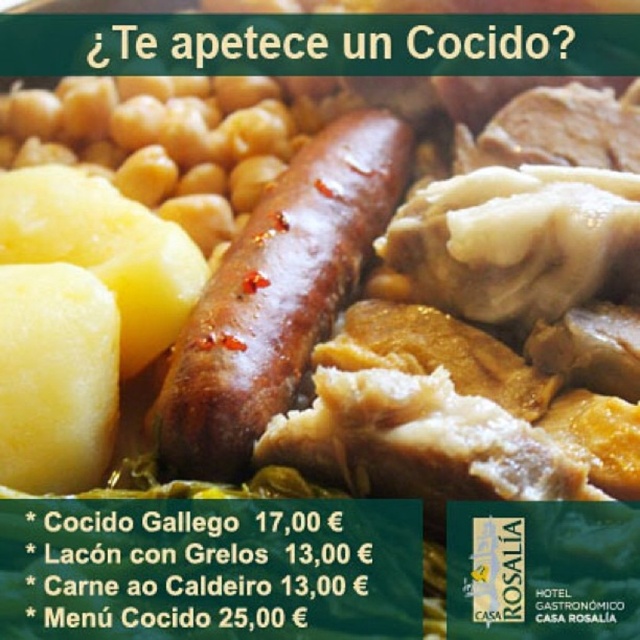
Question: Which point appears closest to the camera in this image?

Choices:
 (A) (22, 326)
 (B) (355, 138)
 (C) (115, 314)

Answer: (A)

Question: Which point is farther from the camera taking this photo?

Choices:
 (A) tap(33, 456)
 (B) tap(108, 278)
 (C) tap(291, 278)

Answer: (C)

Question: Is yellow smooth potato at left to the left of brown matte sausage at center from the viewer's perspective?

Choices:
 (A) yes
 (B) no

Answer: (A)

Question: Is yellow smooth potato at left behind yellow matte potato at lower left?

Choices:
 (A) yes
 (B) no

Answer: (A)

Question: Among these objects, which one is farthest from the camera?

Choices:
 (A) yellow matte potato at lower left
 (B) yellow smooth potato at left
 (C) brown matte sausage at center

Answer: (C)

Question: Does brown matte sausage at center appear over yellow matte potato at lower left?

Choices:
 (A) no
 (B) yes

Answer: (B)